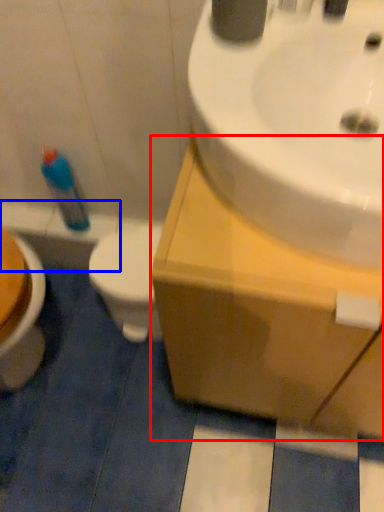
Question: Which object is further to the camera taking this photo, counter top (highlighted by a red box) or bath (highlighted by a blue box)?

Choices:
 (A) counter top
 (B) bath

Answer: (B)